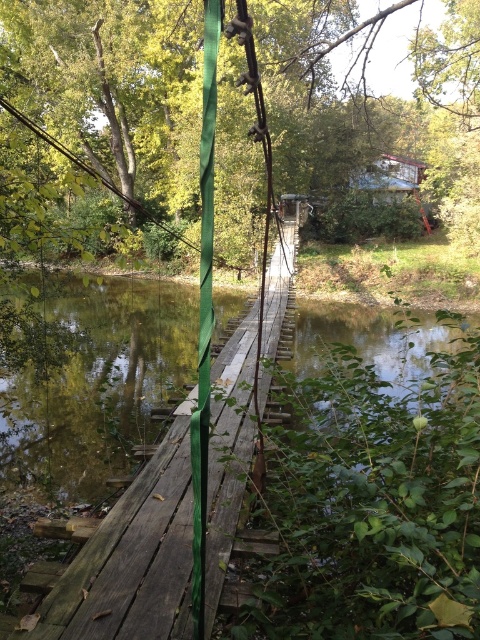
Question: Which object is farther from the camera taking this photo?

Choices:
 (A) green matte pole at center
 (B) green wooden bridge at center

Answer: (B)

Question: Can you confirm if green wooden bridge at center is wider than green matte pole at center?

Choices:
 (A) no
 (B) yes

Answer: (B)

Question: Does green wooden bridge at center come in front of green matte pole at center?

Choices:
 (A) yes
 (B) no

Answer: (B)

Question: Which object is farther from the camera taking this photo?

Choices:
 (A) green matte pole at center
 (B) green wooden bridge at center

Answer: (B)

Question: Can you confirm if green wooden bridge at center is wider than green matte pole at center?

Choices:
 (A) yes
 (B) no

Answer: (A)